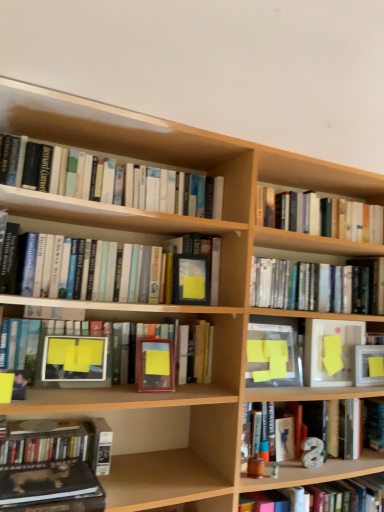
Question: Can matte black book at center, the third paperback book viewed from the right, be found inside hardcover book at center, which is the 6th book in bottom-to-top order?

Choices:
 (A) no
 (B) yes

Answer: (B)

Question: Is hardcover book at center, which is the 6th book in bottom-to-top order, looking in the opposite direction of matte black book at center, which ranks as the 1th paperback book in left-to-right order?

Choices:
 (A) no
 (B) yes

Answer: (A)

Question: Can we say hardcover book at center, which appears as the 2th book when viewed from the top, lies outside matte black book at center, the third paperback book viewed from the right?

Choices:
 (A) yes
 (B) no

Answer: (A)

Question: Does hardcover book at center, which appears as the 2th book when viewed from the top, come behind matte black book at center, which ranks as the 1th paperback book in left-to-right order?

Choices:
 (A) yes
 (B) no

Answer: (B)

Question: From the image's perspective, is hardcover book at center, which appears as the 2th book when viewed from the top, below matte black book at center, the third paperback book viewed from the right?

Choices:
 (A) yes
 (B) no

Answer: (B)

Question: Do you think hardcover book at center, which is the 6th book in bottom-to-top order, is within matte black book at center, the third paperback book viewed from the right, or outside of it?

Choices:
 (A) inside
 (B) outside

Answer: (B)

Question: From the image's perspective, is hardcover book at center, which appears as the 2th book when viewed from the top, located above or below matte black book at center, which ranks as the 1th paperback book in left-to-right order?

Choices:
 (A) below
 (B) above

Answer: (B)

Question: In terms of height, does hardcover book at center, which appears as the 2th book when viewed from the top, look taller or shorter compared to matte black book at center, which ranks as the 1th paperback book in left-to-right order?

Choices:
 (A) tall
 (B) short

Answer: (A)

Question: Looking at their shapes, would you say hardcover book at center, which is the 6th book in bottom-to-top order, is wider or thinner than matte black book at center, the third paperback book viewed from the right?

Choices:
 (A) thin
 (B) wide

Answer: (B)

Question: From a real-world perspective, is brown leather book at lower left, which ranks as the second book in bottom-to-top order, physically located above or below hardcover books at upper right, positioned as the first book in top-to-bottom order?

Choices:
 (A) below
 (B) above

Answer: (A)

Question: Considering the positions of brown leather book at lower left, which ranks as the second book in bottom-to-top order, and hardcover books at upper right, which ranks as the 7th book in bottom-to-top order, in the image, is brown leather book at lower left, which ranks as the second book in bottom-to-top order, bigger or smaller than hardcover books at upper right, which ranks as the 7th book in bottom-to-top order,?

Choices:
 (A) big
 (B) small

Answer: (B)

Question: In the image, is brown leather book at lower left, which ranks as the second book in bottom-to-top order, positioned in front of or behind hardcover books at upper right, positioned as the first book in top-to-bottom order?

Choices:
 (A) front
 (B) behind

Answer: (A)

Question: From the image's perspective, is brown leather book at lower left, which ranks as the second book in bottom-to-top order, positioned above or below hardcover books at upper right, which ranks as the 7th book in bottom-to-top order?

Choices:
 (A) below
 (B) above

Answer: (A)

Question: Considering their positions, is yellow matte paper at center, the second paperback book when ordered from left to right, located in front of or behind matte black book at center, the third paperback book viewed from the right?

Choices:
 (A) front
 (B) behind

Answer: (B)

Question: In terms of width, does yellow matte paper at center, the second paperback book when ordered from left to right, look wider or thinner when compared to matte black book at center, which ranks as the 1th paperback book in left-to-right order?

Choices:
 (A) wide
 (B) thin

Answer: (A)